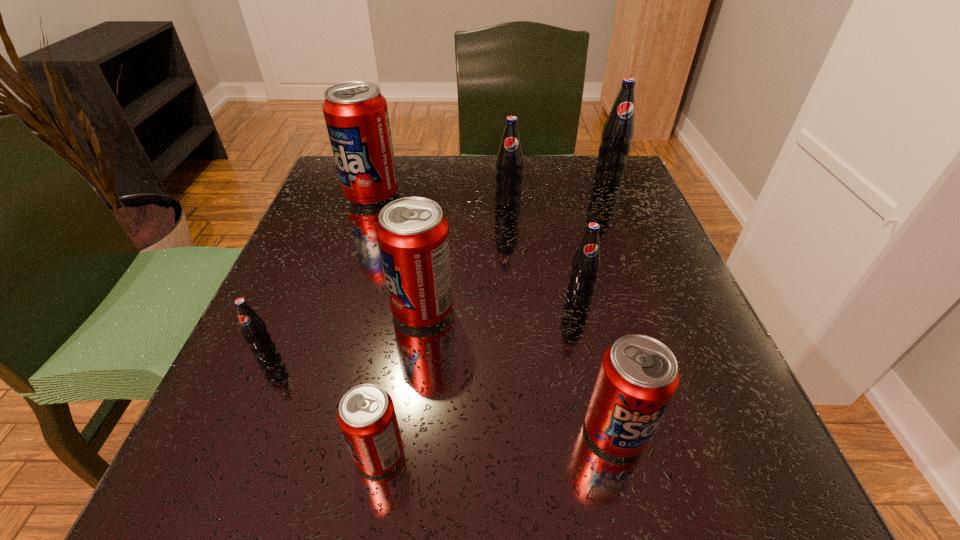
Locate an element on the screen. The height and width of the screenshot is (540, 960). the leftmost object is located at coordinates (253, 328).

At what (x,y) coordinates should I click in order to perform the action: click on the sixth farthest object. Please return your answer as a coordinate pair (x, y). Looking at the image, I should click on (253, 328).

At what (x,y) coordinates should I click in order to perform the action: click on the smallest red soda can. Please return your answer as a coordinate pair (x, y). This screenshot has width=960, height=540. Looking at the image, I should click on (366, 415).

The height and width of the screenshot is (540, 960). Find the location of `free space located 0.170m on the front label of the rightmost soda can`. free space located 0.170m on the front label of the rightmost soda can is located at coordinates (629, 232).

You are a GUI agent. You are given a task and a screenshot of the screen. Output one action in this format:
    pyautogui.click(x=<x>, y=<y>)
    Task: Click on the vacant point located on the back of the farthest red soda can
    Image resolution: width=960 pixels, height=540 pixels.
    Given the screenshot: What is the action you would take?
    pyautogui.click(x=382, y=161)

Identify the location of vacant region located on the front label of the third nearest black pop. The height and width of the screenshot is (540, 960). (511, 239).

At what (x,y) coordinates should I click in order to perform the action: click on vacant space located on the left of the third nearest red soda can. Please return your answer as a coordinate pair (x, y). Looking at the image, I should click on (326, 309).

I want to click on free space located on the front label of the second black pop from right to left, so pyautogui.click(x=603, y=402).

At what (x,y) coordinates should I click in order to perform the action: click on free space located on the left of the rightmost red soda can. Please return your answer as a coordinate pair (x, y). The image size is (960, 540). Looking at the image, I should click on (456, 431).

You are a GUI agent. You are given a task and a screenshot of the screen. Output one action in this format:
    pyautogui.click(x=<x>, y=<y>)
    Task: Click on the free spot located 0.190m on the front label of the leftmost object
    
    Given the screenshot: What is the action you would take?
    pyautogui.click(x=205, y=495)